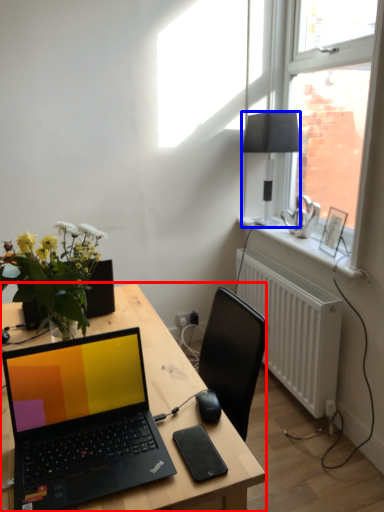
Question: Among these objects, which one is nearest to the camera, desk (highlighted by a red box) or lamp (highlighted by a blue box)?

Choices:
 (A) desk
 (B) lamp

Answer: (A)